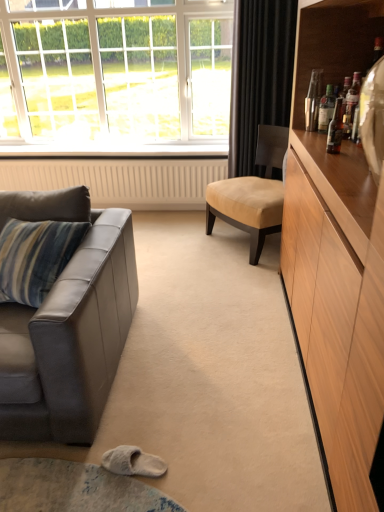
Question: From a real-world perspective, is leather couch at left physically below translucent glass bottle at upper right, arranged as the third bottle when viewed from the back?

Choices:
 (A) yes
 (B) no

Answer: (A)

Question: Is leather couch at left bigger than translucent glass bottle at upper right, arranged as the third bottle when viewed from the back?

Choices:
 (A) yes
 (B) no

Answer: (A)

Question: Is leather couch at left positioned with its back to translucent glass bottle at upper right, marked as the first bottle in a front-to-back arrangement?

Choices:
 (A) no
 (B) yes

Answer: (A)

Question: Is leather couch at left not close to translucent glass bottle at upper right, marked as the first bottle in a front-to-back arrangement?

Choices:
 (A) no
 (B) yes

Answer: (B)

Question: Would you say translucent glass bottle at upper right, marked as the first bottle in a front-to-back arrangement, is part of leather couch at left's contents?

Choices:
 (A) no
 (B) yes

Answer: (A)

Question: Based on their positions, is shiny metallic bottle at upper right, marked as the third bottle in a front-to-back arrangement, located to the left or right of translucent glass bottle at upper right, arranged as the third bottle when viewed from the back?

Choices:
 (A) left
 (B) right

Answer: (B)

Question: Considering the positions of shiny metallic bottle at upper right, which is the first bottle in back-to-front order, and translucent glass bottle at upper right, arranged as the third bottle when viewed from the back, in the image, is shiny metallic bottle at upper right, which is the first bottle in back-to-front order, wider or thinner than translucent glass bottle at upper right, arranged as the third bottle when viewed from the back,?

Choices:
 (A) wide
 (B) thin

Answer: (A)

Question: From their relative heights in the image, would you say shiny metallic bottle at upper right, which is the first bottle in back-to-front order, is taller or shorter than translucent glass bottle at upper right, marked as the first bottle in a front-to-back arrangement?

Choices:
 (A) tall
 (B) short

Answer: (A)

Question: Which is correct: shiny metallic bottle at upper right, marked as the third bottle in a front-to-back arrangement, is inside translucent glass bottle at upper right, arranged as the third bottle when viewed from the back, or outside of it?

Choices:
 (A) outside
 (B) inside

Answer: (A)

Question: From the image's perspective, is leather couch at left located above or below beige textured radiator at lower center?

Choices:
 (A) below
 (B) above

Answer: (A)

Question: Considering the positions of leather couch at left and beige textured radiator at lower center in the image, is leather couch at left taller or shorter than beige textured radiator at lower center?

Choices:
 (A) short
 (B) tall

Answer: (B)

Question: Which is correct: leather couch at left is inside beige textured radiator at lower center, or outside of it?

Choices:
 (A) inside
 (B) outside

Answer: (B)

Question: Visually, is leather couch at left positioned to the left or to the right of beige textured radiator at lower center?

Choices:
 (A) right
 (B) left

Answer: (B)

Question: From a real-world perspective, is white glass window at upper left positioned above or below beige textured radiator at lower center?

Choices:
 (A) above
 (B) below

Answer: (A)

Question: Considering the positions of white glass window at upper left and beige textured radiator at lower center in the image, is white glass window at upper left bigger or smaller than beige textured radiator at lower center?

Choices:
 (A) small
 (B) big

Answer: (B)